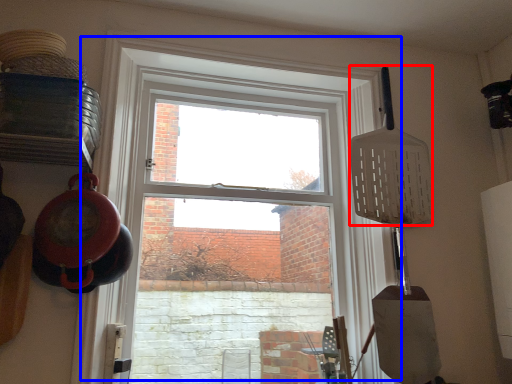
Question: Which point is closer to the camera, spatula (highlighted by a red box) or window (highlighted by a blue box)?

Choices:
 (A) spatula
 (B) window

Answer: (B)